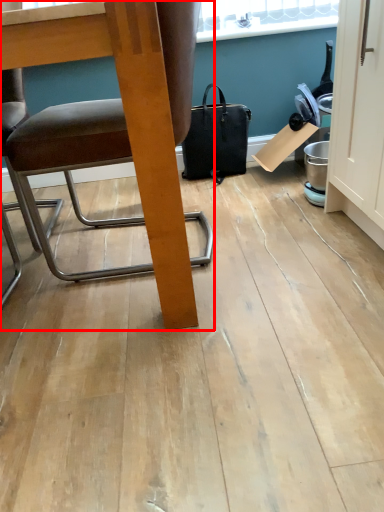
Question: From the image's perspective, where is chair (annotated by the red box) located in relation to handbag in the image?

Choices:
 (A) above
 (B) below

Answer: (B)